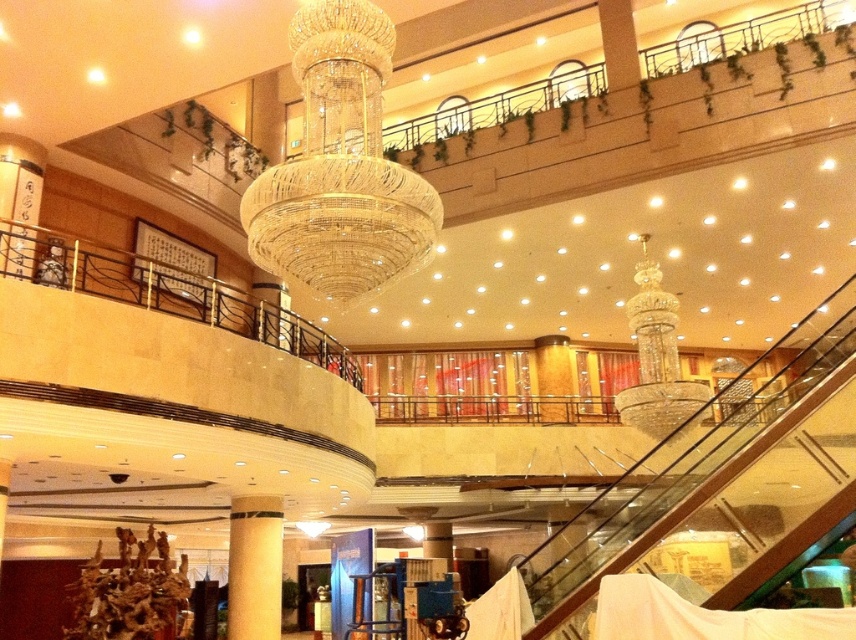
Question: Which point appears farthest from the camera in this image?

Choices:
 (A) (248, 544)
 (B) (437, 218)

Answer: (A)

Question: Does clear crystal chandelier at center have a greater width compared to yellow textured pillar at center?

Choices:
 (A) yes
 (B) no

Answer: (A)

Question: Is clear crystal chandelier at center to the left of yellow textured pillar at center from the viewer's perspective?

Choices:
 (A) yes
 (B) no

Answer: (B)

Question: Does clear crystal chandelier at center come in front of yellow textured pillar at center?

Choices:
 (A) no
 (B) yes

Answer: (B)